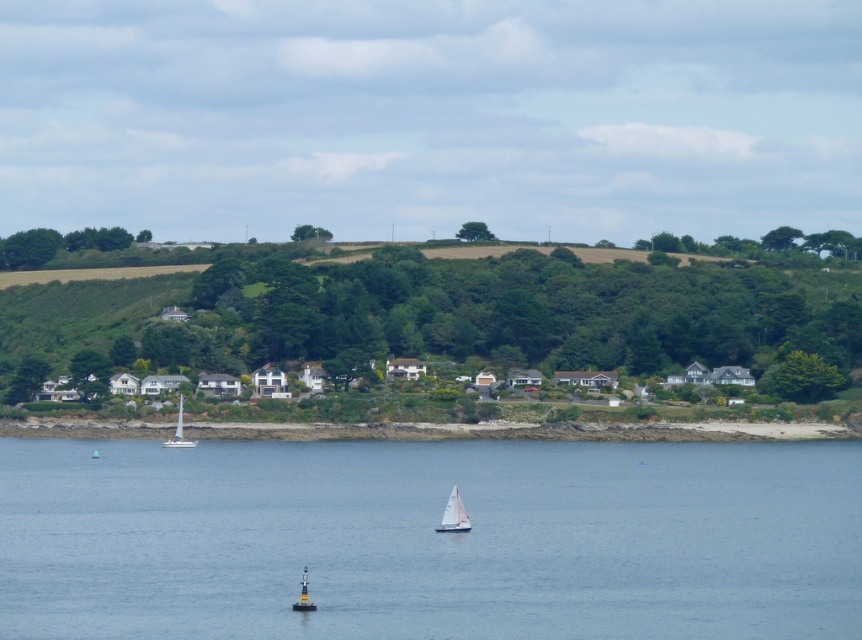
Question: Which object is positioned farthest from the white sailboat at left?

Choices:
 (A) green leafy hillside at center
 (B) yellow buoy at center

Answer: (B)

Question: Can you confirm if white sailboat at left is bigger than yellow buoy at center?

Choices:
 (A) yes
 (B) no

Answer: (B)

Question: Does green leafy hillside at center have a greater width compared to white sailboat at left?

Choices:
 (A) no
 (B) yes

Answer: (B)

Question: Which of these objects is positioned farthest from the white sailboat at center?

Choices:
 (A) green leafy hillside at center
 (B) transparent blue water at center
 (C) yellow buoy at center

Answer: (A)

Question: Which object is farther from the camera taking this photo?

Choices:
 (A) yellow buoy at center
 (B) white sailboat at center
 (C) green leafy hillside at center
 (D) white sailboat at left

Answer: (D)

Question: Is green leafy hillside at center to the left of yellow buoy at center from the viewer's perspective?

Choices:
 (A) yes
 (B) no

Answer: (B)